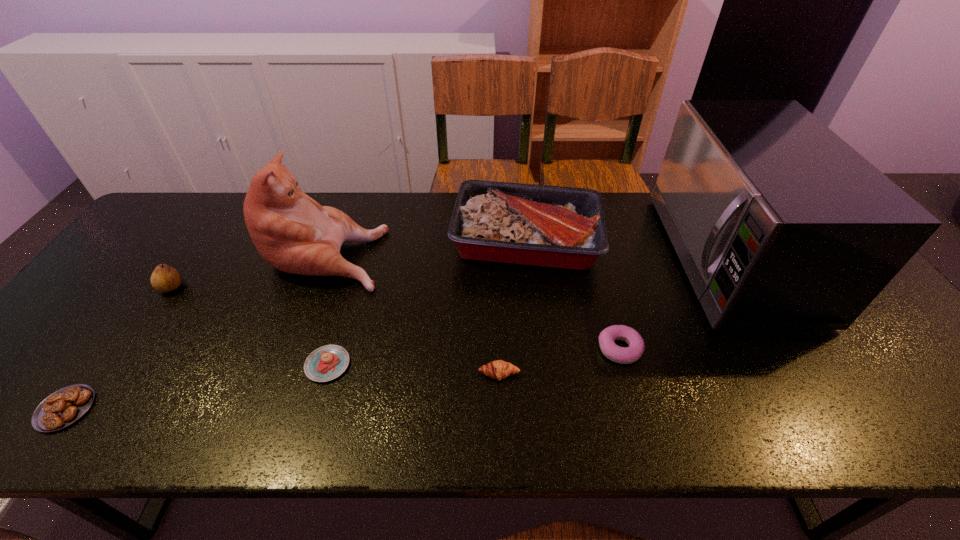
Where is `tray present at the far edge`? The height and width of the screenshot is (540, 960). tray present at the far edge is located at coordinates (551, 226).

The image size is (960, 540). Identify the location of object that is positioned at the near edge. (65, 406).

Locate an element on the screen. The width and height of the screenshot is (960, 540). pear located at the left edge is located at coordinates (164, 278).

At what (x,y) coordinates should I click in order to perform the action: click on pastry present at the left edge. Please return your answer as a coordinate pair (x, y). The width and height of the screenshot is (960, 540). Looking at the image, I should click on (65, 406).

This screenshot has height=540, width=960. I want to click on object located in the right edge section of the desktop, so click(x=779, y=224).

In order to click on object positioned at the near left corner in this screenshot , I will do `click(65, 406)`.

Locate an element on the screen. Image resolution: width=960 pixels, height=540 pixels. object present at the far right corner is located at coordinates (779, 224).

This screenshot has height=540, width=960. I want to click on vacant region at the far edge, so click(x=386, y=202).

Identify the location of vacant region at the near edge of the desktop. (321, 434).

Locate an element on the screen. free space between the pear and the cat is located at coordinates (250, 269).